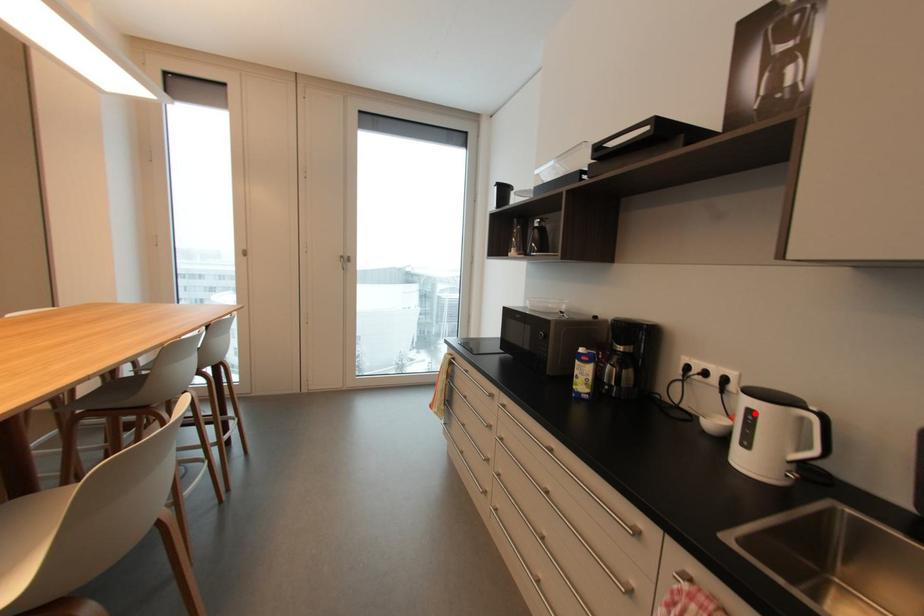
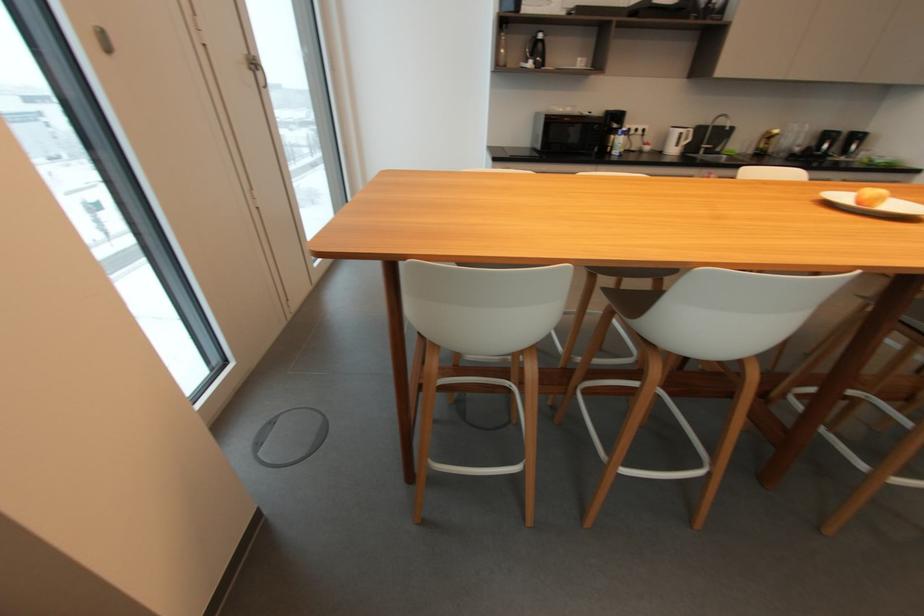
Locate, in the second image, the point that corresponds to the highlighted location in the first image.

(685, 134)